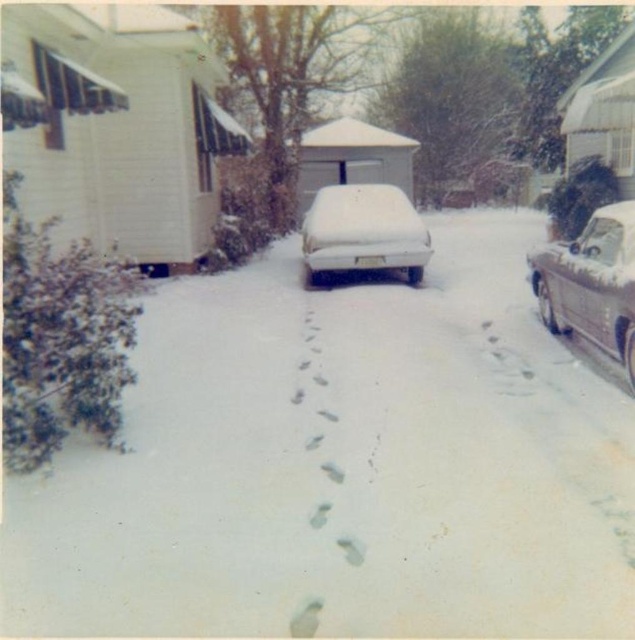
Does silver metallic car at right come behind white matte car at center?

No, it is not.

Can you confirm if silver metallic car at right is smaller than white matte car at center?

No.

Does point (617, 291) come farther from viewer compared to point (335, 220)?

No.

You are a GUI agent. You are given a task and a screenshot of the screen. Output one action in this format:
    pyautogui.click(x=<x>, y=<y>)
    Task: Click on the silver metallic car at right
    
    Given the screenshot: What is the action you would take?
    pyautogui.click(x=591, y=284)

Is white snow-covered driveway at center positioned at the back of silver metallic car at right?

No, it is in front of silver metallic car at right.

Is white snow-covered driveway at center to the left of silver metallic car at right from the viewer's perspective?

Correct, you'll find white snow-covered driveway at center to the left of silver metallic car at right.

The image size is (635, 640). I want to click on white snow-covered driveway at center, so click(342, 465).

Identify the location of white snow-covered driveway at center. This screenshot has height=640, width=635. (342, 465).

Can you confirm if white snow-covered driveway at center is positioned below white matte car at center?

Indeed, white snow-covered driveway at center is positioned under white matte car at center.

Can you confirm if white snow-covered driveway at center is positioned to the right of white matte car at center?

No, white snow-covered driveway at center is not to the right of white matte car at center.

The width and height of the screenshot is (635, 640). Identify the location of white snow-covered driveway at center. (342, 465).